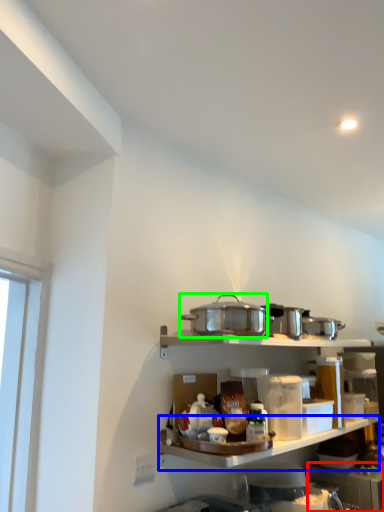
Question: Which object is positioned closest to appliance (highlighted by a red box)? Select from shelf (highlighted by a blue box) and appliance (highlighted by a green box).

Choices:
 (A) shelf
 (B) appliance

Answer: (A)